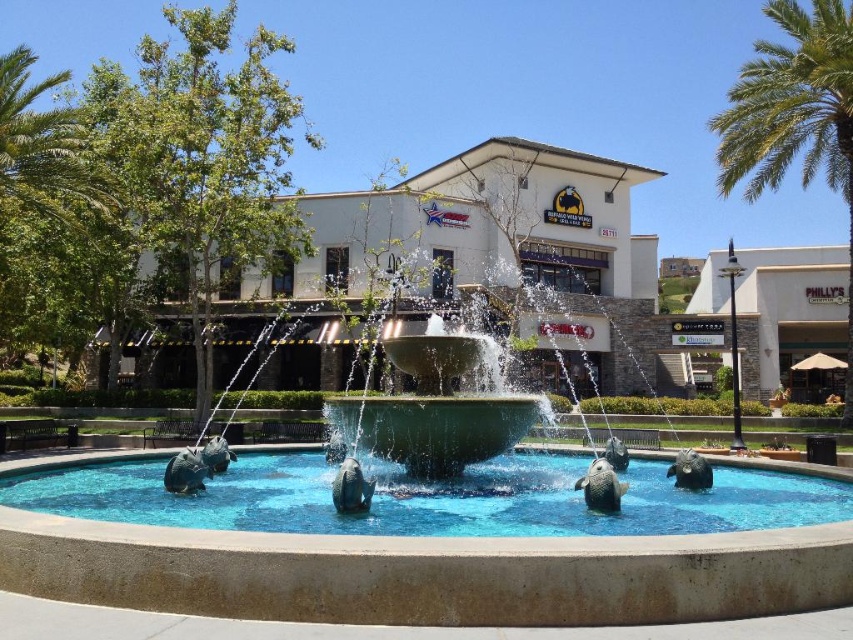
Is green stone fountain at center shorter than white stone building at right?

Correct, green stone fountain at center is not as tall as white stone building at right.

Can you confirm if green stone fountain at center is wider than white stone building at right?

Incorrect, green stone fountain at center's width does not surpass white stone building at right's.

Locate an element on the screen. Image resolution: width=853 pixels, height=640 pixels. green stone fountain at center is located at coordinates (426, 573).

Identify the location of green stone fountain at center. This screenshot has width=853, height=640. tap(426, 573).

In the scene shown: Measure the distance from green stone fountain at center to green leafy palm tree at upper right.

green stone fountain at center is 20.50 meters away from green leafy palm tree at upper right.

I want to click on green stone fountain at center, so click(426, 573).

Is point (526, 221) closer to viewer compared to point (810, 260)?

Yes, point (526, 221) is closer to viewer.

Based on the photo, between white stucco building at center and white stone building at right, which one appears on the left side from the viewer's perspective?

white stucco building at center

Which is in front, point (508, 266) or point (838, 248)?

Point (508, 266) is more forward.

Locate an element on the screen. The width and height of the screenshot is (853, 640). white stucco building at center is located at coordinates (469, 250).